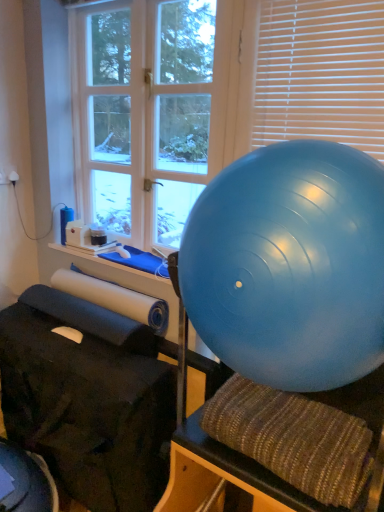
Describe the element at coordinates (293, 439) in the screenshot. I see `textured brown bean bag chair at center` at that location.

What do you see at coordinates (149, 111) in the screenshot? I see `white wood window at upper left` at bounding box center [149, 111].

Where is `white plastic blinds at upper right`? white plastic blinds at upper right is located at coordinates (320, 73).

Is white wood window at upper left outside of blue rubber ball at right?

Yes, white wood window at upper left is located beyond the bounds of blue rubber ball at right.

From a real-world perspective, between white wood window at upper left and blue rubber ball at right, who is vertically higher?

white wood window at upper left, from a real-world perspective.

Looking at this image, is white wood window at upper left bigger than blue rubber ball at right?

No, white wood window at upper left is not bigger than blue rubber ball at right.

Who is shorter, white wood window at upper left or blue rubber ball at right?

blue rubber ball at right is shorter.

Between point (371, 283) and point (278, 48), which one is positioned behind?

The point (278, 48) is more distant.

From the image's perspective, who appears lower, blue rubber ball at right or white plastic blinds at upper right?

blue rubber ball at right appears lower in the image.

From a real-world perspective, is blue rubber ball at right located beneath white plastic blinds at upper right?

Yes, from a real-world perspective, blue rubber ball at right is below white plastic blinds at upper right.

From a real-world perspective, is white plastic blinds at upper right positioned above or below white wood window at upper left?

In terms of real-world spatial position, white plastic blinds at upper right is above white wood window at upper left.

Consider the image. Is white wood window at upper left at the back of white plastic blinds at upper right?

No, white plastic blinds at upper right's orientation is not away from white wood window at upper left.

Considering the relative sizes of white plastic blinds at upper right and white wood window at upper left in the image provided, is white plastic blinds at upper right wider than white wood window at upper left?

Incorrect, the width of white plastic blinds at upper right does not surpass that of white wood window at upper left.

Is white plastic blinds at upper right at the left side of blue rubber ball at right?

No.

Could you tell me if white plastic blinds at upper right is turned towards blue rubber ball at right?

No, white plastic blinds at upper right is not turned towards blue rubber ball at right.

Between white plastic blinds at upper right and blue rubber ball at right, which one has smaller size?

white plastic blinds at upper right is smaller.

Could you tell me if blue rubber ball at right is turned towards white wood window at upper left?

No.

Can you confirm if blue rubber ball at right is bigger than white wood window at upper left?

Yes.

From the picture: How distant is blue rubber ball at right from white wood window at upper left?

A distance of 92.03 centimeters exists between blue rubber ball at right and white wood window at upper left.

In the image, is blue rubber ball at right on the left side or the right side of white wood window at upper left?

From the image, it's evident that blue rubber ball at right is to the right of white wood window at upper left.

In the scene shown: Considering the sizes of objects white wood window at upper left and white plastic blinds at upper right in the image provided, who is bigger, white wood window at upper left or white plastic blinds at upper right?

With larger size is white wood window at upper left.

Is white wood window at upper left not within white plastic blinds at upper right?

Yes, white wood window at upper left is not within white plastic blinds at upper right.

From the image's perspective, which one is positioned higher, white wood window at upper left or white plastic blinds at upper right?

white wood window at upper left.

Is white wood window at upper left facing away from white plastic blinds at upper right?

No, white wood window at upper left is not facing away from white plastic blinds at upper right.

Is white wood window at upper left touching textured brown bean bag chair at center?

white wood window at upper left and textured brown bean bag chair at center are clearly separated.

Does white wood window at upper left have a lesser width compared to textured brown bean bag chair at center?

Correct, the width of white wood window at upper left is less than that of textured brown bean bag chair at center.

Does point (212, 40) lie in front of point (267, 426)?

No, it is not.

From the image's perspective, is white wood window at upper left above or below textured brown bean bag chair at center?

Based on their image positions, white wood window at upper left is located above textured brown bean bag chair at center.

In the image, there is a white wood window at upper left. Where is `ball below it (from a real-world perspective)`? ball below it (from a real-world perspective) is located at coordinates (290, 265).

Identify the location of blind on the right of blue rubber ball at right. This screenshot has width=384, height=512. (320, 73).

Considering their positions, is textured brown bean bag chair at center positioned further to blue rubber ball at right than white wood window at upper left?

white wood window at upper left is positioned further to the anchor blue rubber ball at right.

Considering their positions, is white plastic blinds at upper right positioned closer to textured brown bean bag chair at center than blue rubber ball at right?

blue rubber ball at right lies closer to textured brown bean bag chair at center than the other object.

Estimate the real-world distances between objects in this image. Which object is further from textured brown bean bag chair at center, blue rubber ball at right or white wood window at upper left?

white wood window at upper left.

Estimate the real-world distances between objects in this image. Which object is further from textured brown bean bag chair at center, white plastic blinds at upper right or white wood window at upper left?

white wood window at upper left is further to textured brown bean bag chair at center.

Looking at the image, which one is located further to white plastic blinds at upper right, textured brown bean bag chair at center or white wood window at upper left?

Based on the image, textured brown bean bag chair at center appears to be further to white plastic blinds at upper right.

Looking at the image, which one is located further to blue rubber ball at right, white wood window at upper left or textured brown bean bag chair at center?

white wood window at upper left.

Looking at this image, based on their spatial positions, is blue rubber ball at right or white plastic blinds at upper right further from white wood window at upper left?

blue rubber ball at right is further to white wood window at upper left.

Looking at this image, estimate the real-world distances between objects in this image. Which object is closer to white plastic blinds at upper right, blue rubber ball at right or textured brown bean bag chair at center?

The object closer to white plastic blinds at upper right is blue rubber ball at right.

At what (x,y) coordinates should I click in order to perform the action: click on ball that lies between white plastic blinds at upper right and textured brown bean bag chair at center from top to bottom. Please return your answer as a coordinate pair (x, y). Looking at the image, I should click on (290, 265).

The width and height of the screenshot is (384, 512). Identify the location of ball between white wood window at upper left and textured brown bean bag chair at center from top to bottom. (290, 265).

Find the location of a particular element. The height and width of the screenshot is (512, 384). blind between white wood window at upper left and textured brown bean bag chair at center in the up-down direction is located at coordinates (320, 73).

This screenshot has height=512, width=384. I want to click on blind between blue rubber ball at right and white wood window at upper left along the z-axis, so (x=320, y=73).